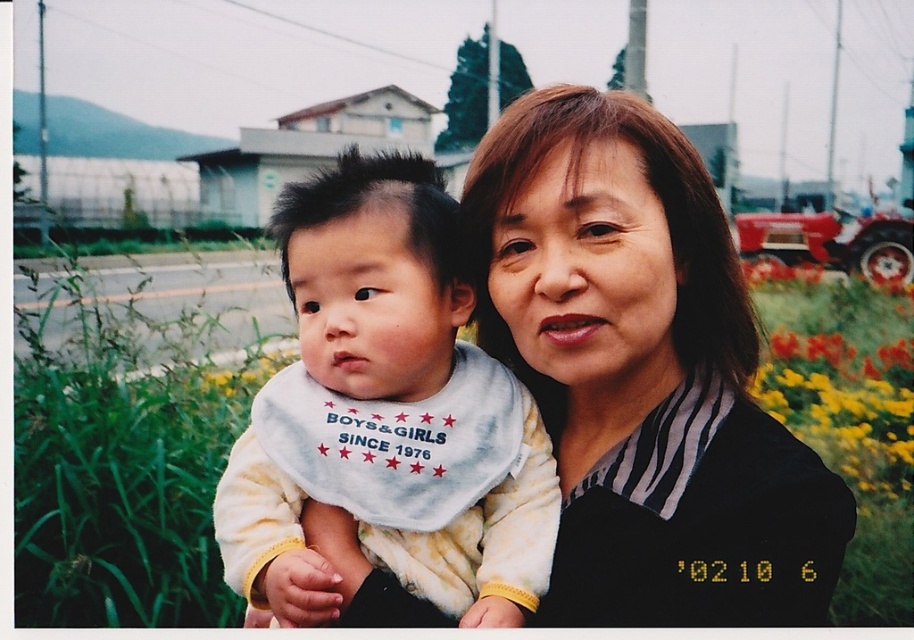
Question: In this image, where is smooth black shirt at center located relative to yellow fabric flower at right?

Choices:
 (A) right
 (B) left

Answer: (B)

Question: Is smooth black shirt at center bigger than yellow fabric flower at right?

Choices:
 (A) no
 (B) yes

Answer: (A)

Question: Which object is farther from the camera taking this photo?

Choices:
 (A) smooth black shirt at center
 (B) white fleece bib at center

Answer: (B)

Question: Which object is closer to the camera taking this photo?

Choices:
 (A) white fleece bib at center
 (B) yellow fabric flower at right
 (C) smooth black shirt at center

Answer: (C)

Question: Does smooth black shirt at center have a greater width compared to yellow fabric flower at right?

Choices:
 (A) no
 (B) yes

Answer: (A)

Question: Which point appears closest to the camera in this image?

Choices:
 (A) (881, 428)
 (B) (258, 538)

Answer: (B)